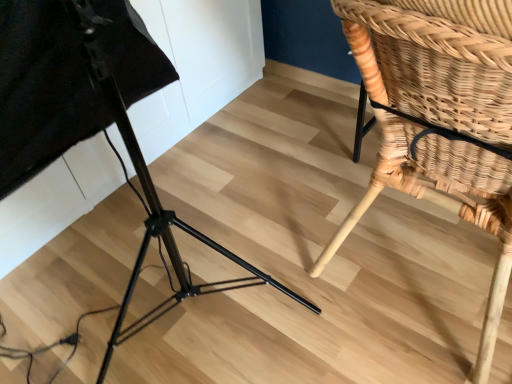
Question: Is woven wood chair at lower right aimed at black metal tripod at lower left?

Choices:
 (A) no
 (B) yes

Answer: (A)

Question: Is woven wood chair at lower right shorter than black metal tripod at lower left?

Choices:
 (A) yes
 (B) no

Answer: (A)

Question: From a real-world perspective, does woven wood chair at lower right sit lower than black metal tripod at lower left?

Choices:
 (A) no
 (B) yes

Answer: (B)

Question: Is woven wood chair at lower right outside black metal tripod at lower left?

Choices:
 (A) no
 (B) yes

Answer: (B)

Question: Is woven wood chair at lower right taller than black metal tripod at lower left?

Choices:
 (A) yes
 (B) no

Answer: (B)

Question: Does woven wood chair at lower right appear on the left side of black metal tripod at lower left?

Choices:
 (A) yes
 (B) no

Answer: (B)

Question: Is the depth of black metal tripod at lower left greater than that of woven wood chair at lower right?

Choices:
 (A) no
 (B) yes

Answer: (A)

Question: Is black metal tripod at lower left shorter than woven wood chair at lower right?

Choices:
 (A) no
 (B) yes

Answer: (A)

Question: Is black metal tripod at lower left bigger than woven wood chair at lower right?

Choices:
 (A) no
 (B) yes

Answer: (B)

Question: Is black metal tripod at lower left smaller than woven wood chair at lower right?

Choices:
 (A) yes
 (B) no

Answer: (B)

Question: Is black metal tripod at lower left directly adjacent to woven wood chair at lower right?

Choices:
 (A) no
 (B) yes

Answer: (A)

Question: Would you say black metal tripod at lower left contains woven wood chair at lower right?

Choices:
 (A) yes
 (B) no

Answer: (B)

Question: Based on their sizes in the image, would you say woven wood chair at lower right is bigger or smaller than black metal tripod at lower left?

Choices:
 (A) small
 (B) big

Answer: (A)